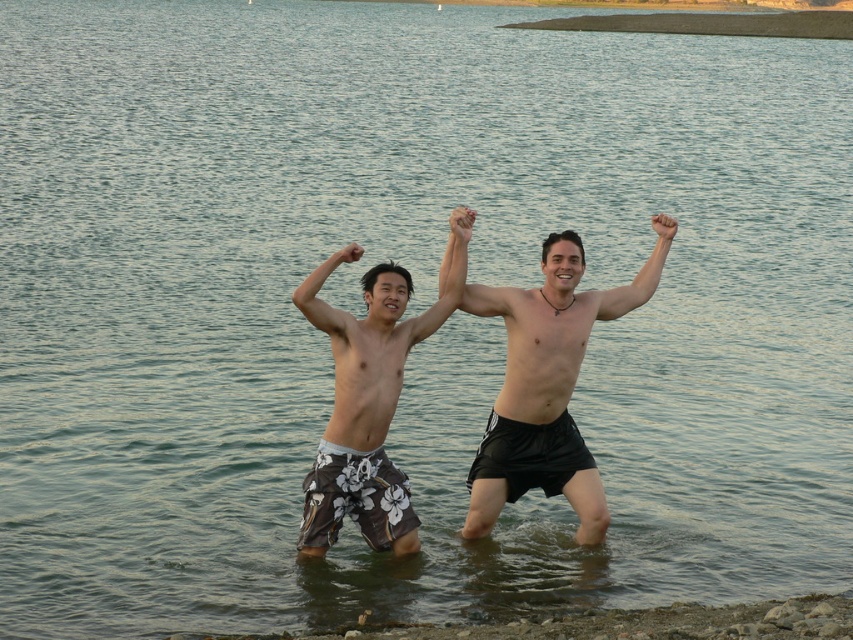
Question: Which of the following is the farthest from the observer?

Choices:
 (A) (469, 230)
 (B) (305, 300)
 (C) (508, 292)

Answer: (C)

Question: Is floral-patterned shorts at center closer to camera compared to matte floral shorts at center?

Choices:
 (A) no
 (B) yes

Answer: (B)

Question: Is matte black arm at center thinner than matte floral shorts at center?

Choices:
 (A) no
 (B) yes

Answer: (A)

Question: Which of the following is the farthest from the observer?

Choices:
 (A) (340, 323)
 (B) (514, 352)

Answer: (B)

Question: Does floral-patterned shorts at center appear under smooth skin arm at center?

Choices:
 (A) no
 (B) yes

Answer: (B)

Question: Which object is the closest to the matte black arm at upper center?

Choices:
 (A) matte floral shorts at center
 (B) floral-patterned shorts at center
 (C) smooth skin arm at center
 (D) matte black arm at center

Answer: (D)